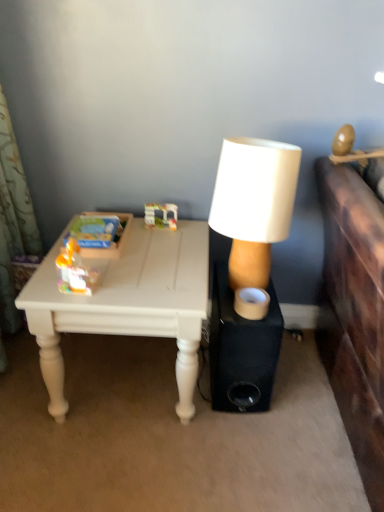
Where is `black matte speaker at center`? The image size is (384, 512). black matte speaker at center is located at coordinates (241, 350).

Identify the location of translucent plastic toy at center, arranged as the first toy when viewed from the right. (161, 215).

Find the location of a particular element. matte plastic toy at left, the 2th toy when ordered from back to front is located at coordinates (74, 270).

Find the location of a particular element. black matte speaker at center is located at coordinates (241, 350).

From the picture: From the image's perspective, is white matte lamp at center located beneath matte plastic toy at left, the 2th toy when ordered from back to front?

No, from the image's perspective, white matte lamp at center is not beneath matte plastic toy at left, the 2th toy when ordered from back to front.

Is white matte lamp at center positioned before matte plastic toy at left, the first toy in the left-to-right sequence?

Yes, the depth of white matte lamp at center is less than that of matte plastic toy at left, the first toy in the left-to-right sequence.

Consider the image. Who is smaller, white matte lamp at center or matte plastic toy at left, the first toy in the left-to-right sequence?

Smaller between the two is matte plastic toy at left, the first toy in the left-to-right sequence.

From a real-world perspective, is white matte lamp at center on matte plastic toy at left, placed as the 1th toy when sorted from bottom to top?

Yes.

Are black matte speaker at center and white matte lamp at center located far from each other?

No, there isn't a large distance between black matte speaker at center and white matte lamp at center.

Does black matte speaker at center have a greater height compared to white matte lamp at center?

Incorrect, the height of black matte speaker at center is not larger of that of white matte lamp at center.

From the image's perspective, is black matte speaker at center above or below white matte lamp at center?

From the image's perspective, black matte speaker at center appears below white matte lamp at center.

Are white matte lamp at center and translucent plastic toy at center, which is the first toy in back-to-front order, located far from each other?

No, white matte lamp at center is not far from translucent plastic toy at center, which is the first toy in back-to-front order.

What's the angular difference between white matte lamp at center and translucent plastic toy at center, arranged as the first toy when viewed from the right,'s facing directions?

The facing directions of white matte lamp at center and translucent plastic toy at center, arranged as the first toy when viewed from the right, are 1.01 degrees apart.

Is white matte lamp at center taller or shorter than translucent plastic toy at center, which is the first toy in back-to-front order?

white matte lamp at center is taller than translucent plastic toy at center, which is the first toy in back-to-front order.

Is white matte lamp at center bigger than translucent plastic toy at center, arranged as the 1th toy when viewed from the top?

Yes.

Is matte plastic toy at left, the first toy in the left-to-right sequence, placed right next to white painted wood table at lower left?

No, matte plastic toy at left, the first toy in the left-to-right sequence, is not next to white painted wood table at lower left.

Is matte plastic toy at left, placed as the 1th toy when sorted from bottom to top, oriented towards white painted wood table at lower left?

No, matte plastic toy at left, placed as the 1th toy when sorted from bottom to top, is not oriented towards white painted wood table at lower left.

In terms of height, does matte plastic toy at left, marked as the first toy in a front-to-back arrangement, look taller or shorter compared to white painted wood table at lower left?

Clearly, matte plastic toy at left, marked as the first toy in a front-to-back arrangement, is shorter compared to white painted wood table at lower left.

Which point is more forward, (87, 274) or (31, 296)?

The point (31, 296) is in front.

From the picture: Is white matte lamp at center closer to camera compared to black matte speaker at center?

Yes.

Can you confirm if white matte lamp at center is taller than black matte speaker at center?

Correct, white matte lamp at center is much taller as black matte speaker at center.

From the image's perspective, which one is positioned higher, white matte lamp at center or black matte speaker at center?

white matte lamp at center is shown above in the image.

Can you tell me how much white matte lamp at center and black matte speaker at center differ in facing direction?

The angle between the facing direction of white matte lamp at center and the facing direction of black matte speaker at center is 4.4 degrees.

Can you tell me how much black matte speaker at center and translucent plastic toy at center, the 2th toy when ordered from left to right, differ in facing direction?

The facing directions of black matte speaker at center and translucent plastic toy at center, the 2th toy when ordered from left to right, are 5.41 degrees apart.

From the image's perspective, is black matte speaker at center above or below translucent plastic toy at center, the 2th toy when ordered from left to right?

black matte speaker at center is below translucent plastic toy at center, the 2th toy when ordered from left to right.

This screenshot has height=512, width=384. Find the location of `speaker that appears on the right of translucent plastic toy at center, the 2th toy in the bottom-to-top sequence`. speaker that appears on the right of translucent plastic toy at center, the 2th toy in the bottom-to-top sequence is located at coordinates (241, 350).

Can we say black matte speaker at center lies outside translucent plastic toy at center, the 2th toy in the bottom-to-top sequence?

That's correct, black matte speaker at center is outside of translucent plastic toy at center, the 2th toy in the bottom-to-top sequence.

From the image's perspective, is black matte speaker at center below matte plastic toy at left, marked as the 2th toy in a top-to-bottom arrangement?

Yes, from the image's perspective, black matte speaker at center is below matte plastic toy at left, marked as the 2th toy in a top-to-bottom arrangement.

Considering the relative sizes of black matte speaker at center and matte plastic toy at left, which appears as the second toy when viewed from the right, in the image provided, is black matte speaker at center wider than matte plastic toy at left, which appears as the second toy when viewed from the right,?

Yes, black matte speaker at center is wider than matte plastic toy at left, which appears as the second toy when viewed from the right.

From a real-world perspective, is black matte speaker at center located beneath matte plastic toy at left, which appears as the second toy when viewed from the right?

Yes, from a real-world perspective, black matte speaker at center is beneath matte plastic toy at left, which appears as the second toy when viewed from the right.

Considering the positions of objects black matte speaker at center and matte plastic toy at left, marked as the first toy in a front-to-back arrangement, in the image provided, who is more to the right, black matte speaker at center or matte plastic toy at left, marked as the first toy in a front-to-back arrangement,?

black matte speaker at center.

Starting from the white matte lamp at center, which toy is the 2nd one to the left? Please provide its 2D coordinates.

[(74, 270)]

Locate an element on the screen. The height and width of the screenshot is (512, 384). lamp in front of the black matte speaker at center is located at coordinates (254, 204).

Estimate the real-world distances between objects in this image. Which object is closer to matte plastic toy at left, marked as the first toy in a front-to-back arrangement, translucent plastic toy at center, marked as the 2th toy in a front-to-back arrangement, or black matte speaker at center?

translucent plastic toy at center, marked as the 2th toy in a front-to-back arrangement, is positioned closer to the anchor matte plastic toy at left, marked as the first toy in a front-to-back arrangement.

Which object lies further to the anchor point matte plastic toy at left, placed as the 1th toy when sorted from bottom to top, black matte speaker at center or white matte lamp at center?

Among the two, black matte speaker at center is located further to matte plastic toy at left, placed as the 1th toy when sorted from bottom to top.

Based on their spatial positions, is translucent plastic toy at center, the 2th toy in the bottom-to-top sequence, or matte plastic toy at left, which appears as the second toy when viewed from the right, further from black matte speaker at center?

translucent plastic toy at center, the 2th toy in the bottom-to-top sequence.

Estimate the real-world distances between objects in this image. Which object is closer to white matte lamp at center, white painted wood table at lower left or matte plastic toy at left, marked as the 2th toy in a top-to-bottom arrangement?

white painted wood table at lower left is closer to white matte lamp at center.

Looking at the image, which one is located further to translucent plastic toy at center, arranged as the first toy when viewed from the right, white painted wood table at lower left or white matte lamp at center?

The object further to translucent plastic toy at center, arranged as the first toy when viewed from the right, is white matte lamp at center.

Considering their positions, is black matte speaker at center positioned further to white matte lamp at center than white painted wood table at lower left?

The object further to white matte lamp at center is white painted wood table at lower left.

Looking at the image, which one is located closer to translucent plastic toy at center, arranged as the 1th toy when viewed from the top, white matte lamp at center or black matte speaker at center?

white matte lamp at center is closer to translucent plastic toy at center, arranged as the 1th toy when viewed from the top.

Looking at the image, which one is located closer to matte plastic toy at left, marked as the 2th toy in a top-to-bottom arrangement, white painted wood table at lower left or translucent plastic toy at center, the 2th toy in the bottom-to-top sequence?

Among the two, white painted wood table at lower left is located nearer to matte plastic toy at left, marked as the 2th toy in a top-to-bottom arrangement.

Find the location of `toy between matte plastic toy at left, which appears as the second toy when viewed from the right, and black matte speaker at center, in the horizontal direction`. toy between matte plastic toy at left, which appears as the second toy when viewed from the right, and black matte speaker at center, in the horizontal direction is located at coordinates (161, 215).

Where is `table located between matte plastic toy at left, placed as the 1th toy when sorted from bottom to top, and black matte speaker at center in the left-right direction`? The height and width of the screenshot is (512, 384). table located between matte plastic toy at left, placed as the 1th toy when sorted from bottom to top, and black matte speaker at center in the left-right direction is located at coordinates (127, 303).

Identify the location of toy between matte plastic toy at left, marked as the 2th toy in a top-to-bottom arrangement, and white matte lamp at center, in the horizontal direction. (161, 215).

The height and width of the screenshot is (512, 384). In order to click on lamp that lies between translucent plastic toy at center, marked as the 2th toy in a front-to-back arrangement, and black matte speaker at center from top to bottom in this screenshot , I will do `click(254, 204)`.